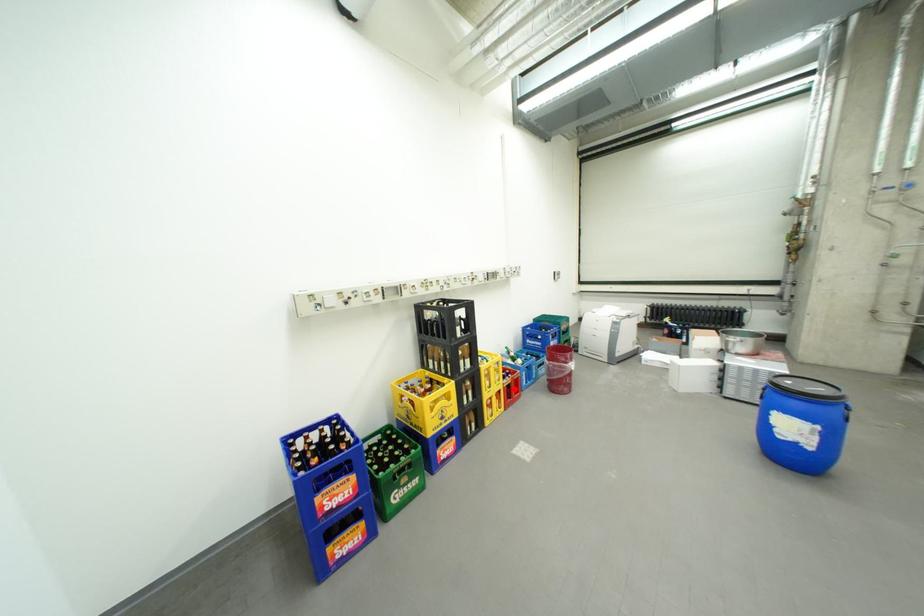
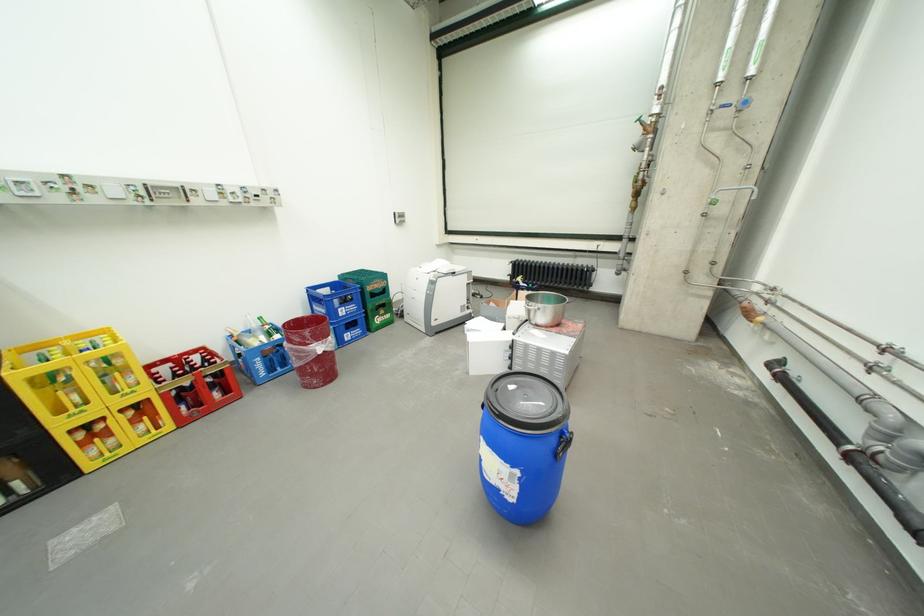
Question: I am providing you with two images of the same scene from different viewpoints. A red point is shown in image1. For the corresponding object point in image2, is it positioned nearer or farther from the camera?

Choices:
 (A) Nearer
 (B) Farther

Answer: (A)